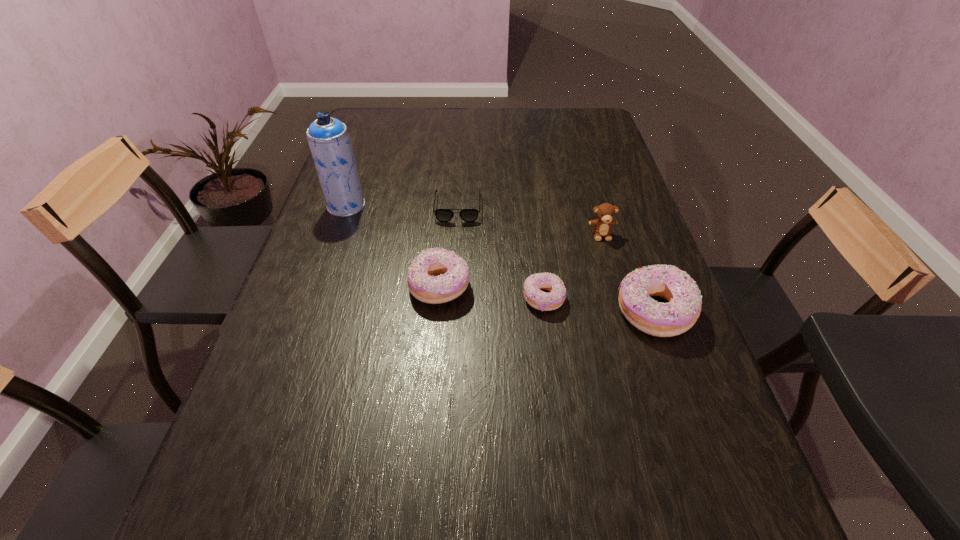
Identify the location of the third shortest object. The image size is (960, 540). (453, 273).

Where is `the second shortest doughnut`? This screenshot has width=960, height=540. the second shortest doughnut is located at coordinates (453, 273).

Image resolution: width=960 pixels, height=540 pixels. I want to click on the shortest doughnut, so click(x=540, y=300).

Identify the location of the second doughnut from left to right. (540, 300).

Locate an element on the screen. the rightmost doughnut is located at coordinates (670, 319).

Find the location of a particular element. Image resolution: width=960 pixels, height=540 pixels. teddy bear is located at coordinates (605, 212).

Locate an element on the screen. spectacles is located at coordinates pyautogui.click(x=443, y=215).

I want to click on the tallest object, so click(328, 138).

Find the location of `the leftmost object`. the leftmost object is located at coordinates (328, 138).

Where is `vacant region located 0.400m on the back of the fourth tallest object`? vacant region located 0.400m on the back of the fourth tallest object is located at coordinates (449, 176).